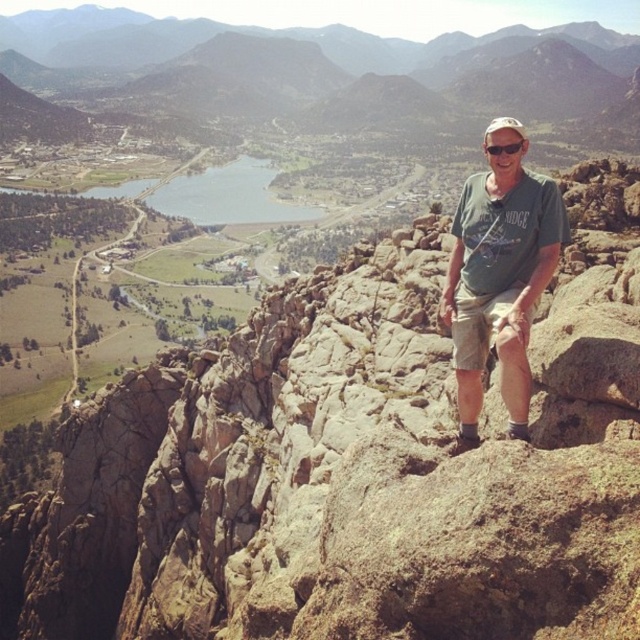
Question: Which object is closer to the camera taking this photo?

Choices:
 (A) brown rocky mountain at center
 (B) green cotton t-shirt at center

Answer: (B)

Question: Considering the relative positions of green cotton t-shirt at center and brown rocky mountain at center in the image provided, where is green cotton t-shirt at center located with respect to brown rocky mountain at center?

Choices:
 (A) above
 (B) below

Answer: (B)

Question: Among these objects, which one is farthest from the camera?

Choices:
 (A) green cotton t-shirt at center
 (B) black plastic goggles at upper center

Answer: (B)

Question: Does green cotton t-shirt at center have a smaller size compared to brown rocky mountain at center?

Choices:
 (A) no
 (B) yes

Answer: (B)

Question: Is green cotton t-shirt at center thinner than black plastic goggles at upper center?

Choices:
 (A) yes
 (B) no

Answer: (A)

Question: Which point is farther to the camera?

Choices:
 (A) (524, 140)
 (B) (636, 52)

Answer: (B)